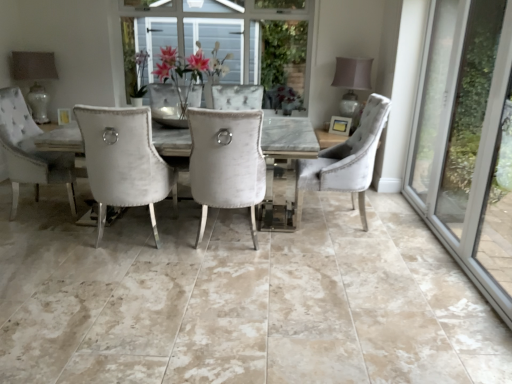
Question: Would you say velvet grey chair at right, which ranks as the first chair in right-to-left order, is inside or outside matte glass lampshade at upper left, arranged as the 1th lamp when viewed from the left?

Choices:
 (A) inside
 (B) outside

Answer: (B)

Question: Looking at their shapes, would you say velvet grey chair at right, the second chair in the left-to-right sequence, is wider or thinner than matte glass lampshade at upper left, which is the second lamp in right-to-left order?

Choices:
 (A) thin
 (B) wide

Answer: (B)

Question: Which is nearer to the velvet grey chair at right, the second chair in the left-to-right sequence?

Choices:
 (A) transparent glass door at right
 (B) matte white vase at upper center
 (C) matte gray lampshade at upper right, arranged as the 2th lamp when viewed from the left
 (D) velvet white chair at center, which ranks as the first chair in left-to-right order
 (E) matte glass lampshade at upper left, which is the second lamp in right-to-left order

Answer: (A)

Question: Estimate the real-world distances between objects in this image. Which object is farther from the matte gray lampshade at upper right, the first lamp from the right?

Choices:
 (A) matte glass lampshade at upper left, arranged as the 1th lamp when viewed from the left
 (B) transparent glass door at right
 (C) velvet grey chair at right, the second chair in the left-to-right sequence
 (D) matte white vase at upper center
 (E) velvet white chair at center, marked as the 2th chair in a right-to-left arrangement

Answer: (A)